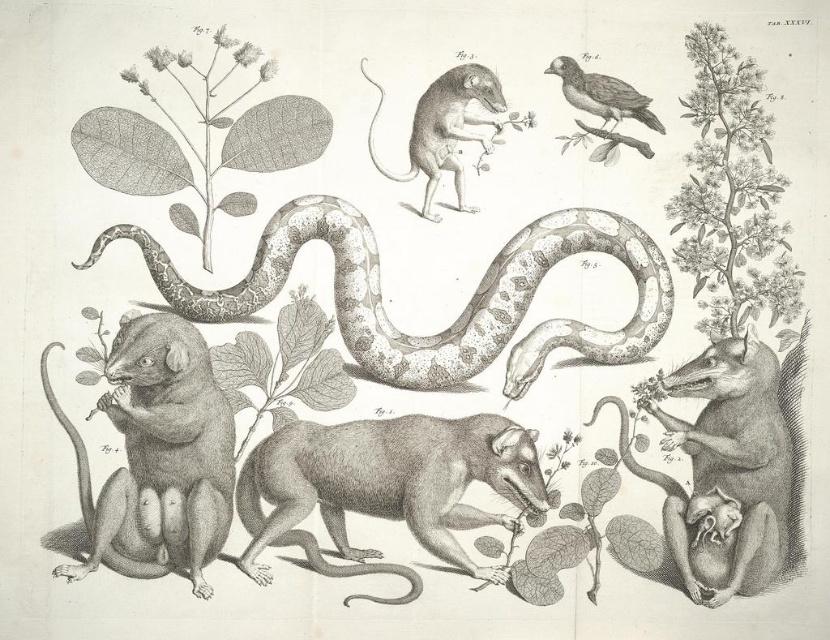
Question: Can you confirm if brown furry rodent at lower left is positioned above brown feathered bird at upper right?

Choices:
 (A) yes
 (B) no

Answer: (B)

Question: Based on their relative distances, which object is nearer to the brown furry rodent at center?

Choices:
 (A) brown furry rodent at lower left
 (B) brown feathered bird at upper right
 (C) speckled gray snake at center
 (D) smooth gray mouse at center

Answer: (C)

Question: Which object is closer to the camera taking this photo?

Choices:
 (A) brown furry rodent at lower left
 (B) brown feathered bird at upper right
 (C) smooth gray mouse at center
 (D) speckled gray snake at center

Answer: (A)

Question: Is fluffy white flowers at upper right closer to camera compared to brown feathered bird at upper right?

Choices:
 (A) yes
 (B) no

Answer: (A)

Question: Which point appears closest to the camera in this image?

Choices:
 (A) (477, 120)
 (B) (664, 131)

Answer: (A)

Question: Is speckled gray snake at center bigger than smooth gray mouse at center?

Choices:
 (A) yes
 (B) no

Answer: (A)